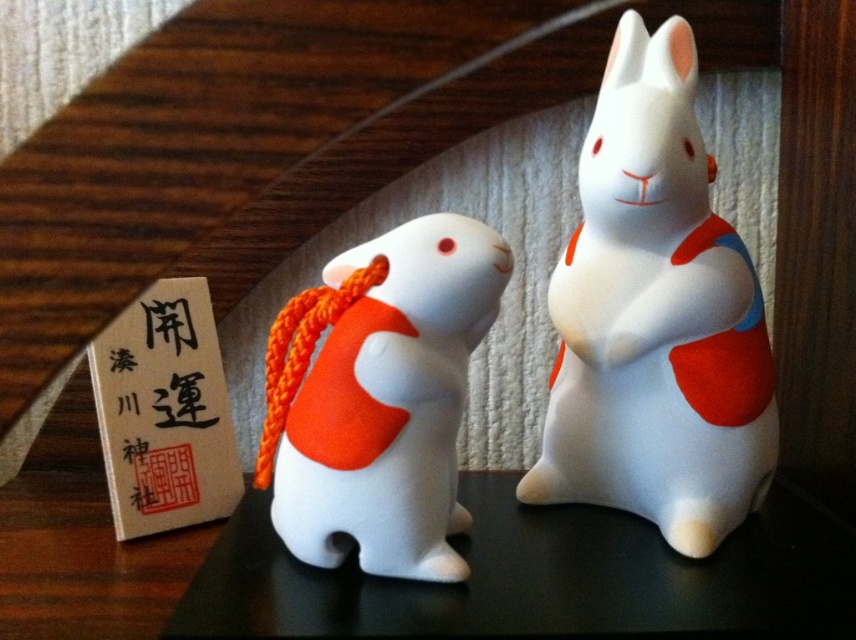
You are organizing a display and need to place both the white glossy rabbit at center and the white matte rabbit at center side by side. Which rabbit should you place on the left to ensure they fit within a 30 cm wide space?

The white glossy rabbit at center is wider than the white matte rabbit at center. To fit within the 30 cm space, place the narrower white matte rabbit at center on the left and the wider white glossy rabbit at center on the right, ensuring their combined width does not exceed the available space.

You are arranging these two rabbits on a shelf and want to ensure that the white glossy rabbit at center is visible. Given that the white matte rabbit at center is currently blocking its view, how should you adjust their positions?

The white matte rabbit at center is behind the white glossy rabbit at center. To make the white glossy rabbit at center visible, move the white matte rabbit at center to the front or reposition it so it no longer blocks the view of the white glossy rabbit at center.